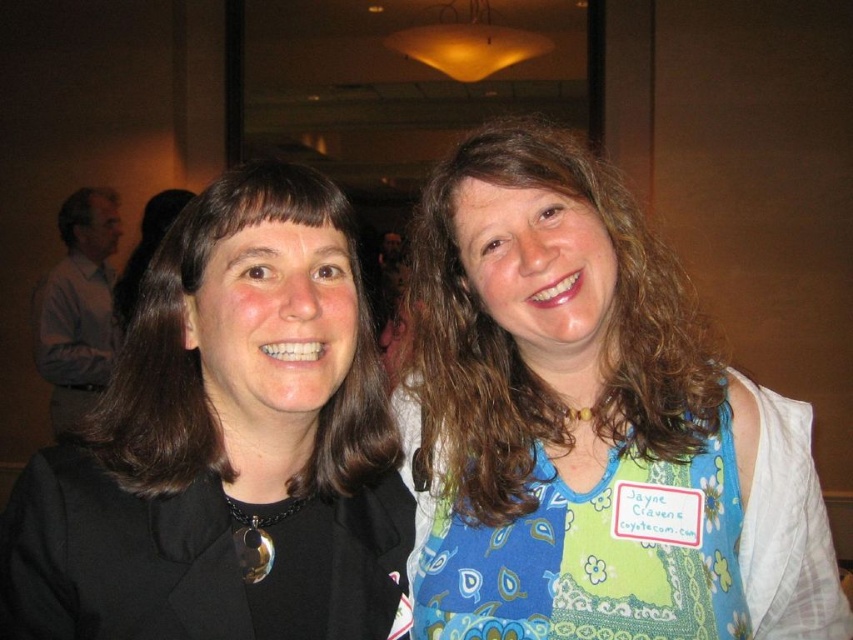
You are at a craft fair and need to hand out a flyer to both people. Since the black fabric at left is in front of the blue patchwork apron at right, which person should you approach first to ensure the flyer is visible?

You should approach the person with the black fabric at left first because it is in front of the blue patchwork apron at right, meaning they are closer to you. Delivering the flyer to them first ensures visibility before reaching the person behind.

You are at a party and want to take a photo with both the blue floral dress at center and the blue patchwork apron at right. Since you can only focus on one object at a time, which one should you focus on to ensure the other is still in the background?

You should focus on the blue floral dress at center because it is in front of the blue patchwork apron at right, so the apron will be in the background when the dress is in focus.

You are a photographer at a social event and need to adjust the camera focus. The blue floral dress at center and the black fabric at left are in the frame. Which object is closer to the camera?

The blue floral dress at center is closer to the camera since it is only 8.23 inches away from the black fabric at left, indicating proximity in the frame.